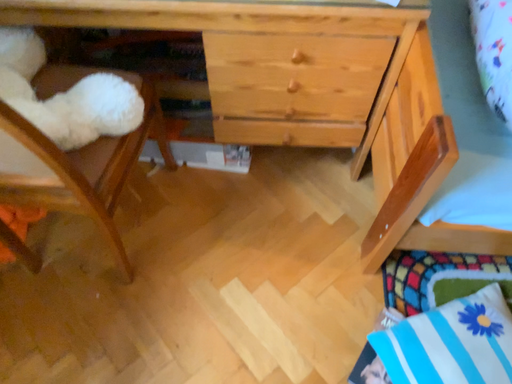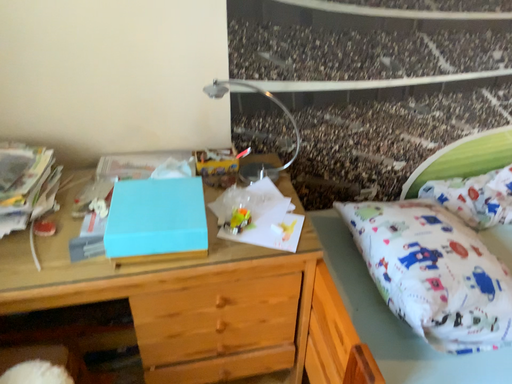
Question: How did the camera likely rotate when shooting the video?

Choices:
 (A) rotated downward
 (B) rotated upward

Answer: (B)